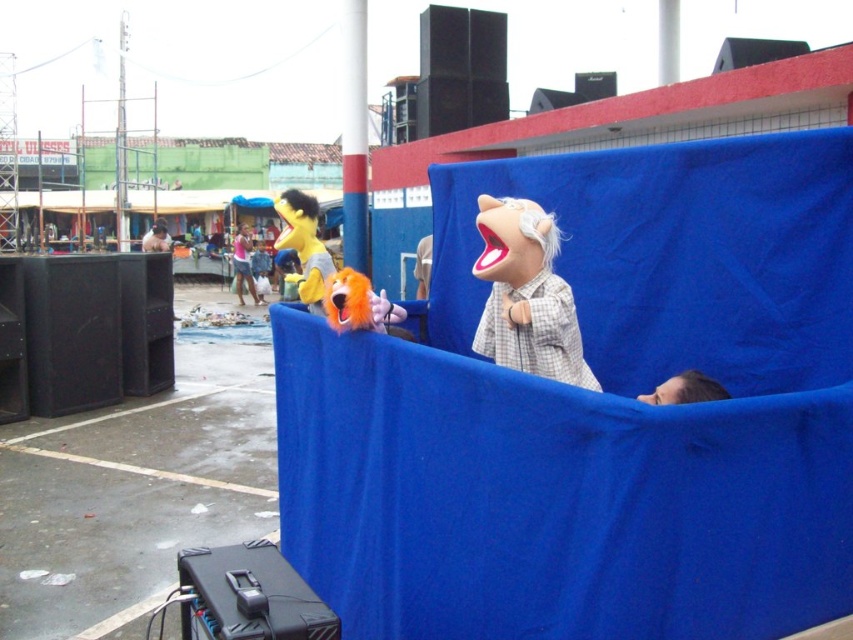
Between matte yellow plush at center and orange plush toy at center, which one is positioned higher?

matte yellow plush at center is higher up.

Is matte yellow plush at center positioned at the back of orange plush toy at center?

Yes, it is.

I want to click on matte yellow plush at center, so click(305, 244).

Between plush/textured puppet at center and orange plush toy at center, which one appears on the left side from the viewer's perspective?

orange plush toy at center is more to the left.

Does point (503, 220) lie in front of point (364, 276)?

Yes, point (503, 220) is in front of point (364, 276).

Where is `plush/textured puppet at center`? Image resolution: width=853 pixels, height=640 pixels. plush/textured puppet at center is located at coordinates (526, 294).

This screenshot has width=853, height=640. Identify the location of plush/textured puppet at center. (526, 294).

Which is in front, point (524, 243) or point (294, 189)?

Point (524, 243) is in front.

Between point (512, 307) and point (314, 246), which one is positioned in front?

Point (512, 307)

The image size is (853, 640). What are the coordinates of `plush/textured puppet at center` in the screenshot? It's located at point(526,294).